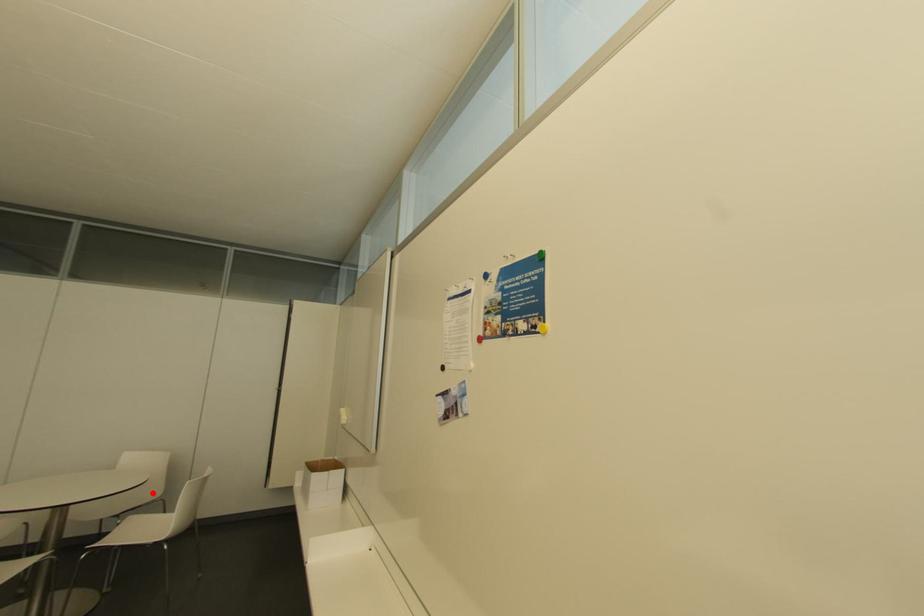
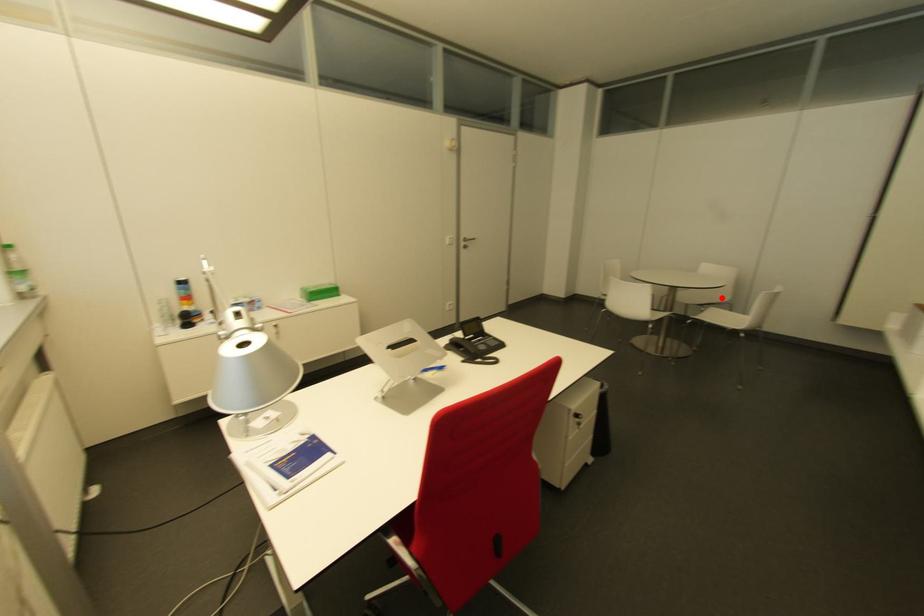
I am providing you with two images of the same scene from different viewpoints. A red point is marked on the first image and another point is marked on the second image. Does the point marked in image1 correspond to the same location as the one in image2?

Yes